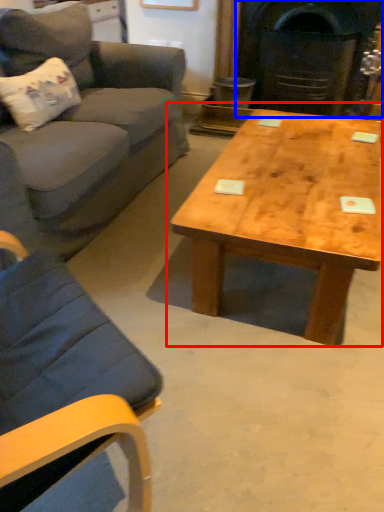
Question: Which object is closer to the camera taking this photo, coffee table (highlighted by a red box) or fireplace (highlighted by a blue box)?

Choices:
 (A) coffee table
 (B) fireplace

Answer: (A)